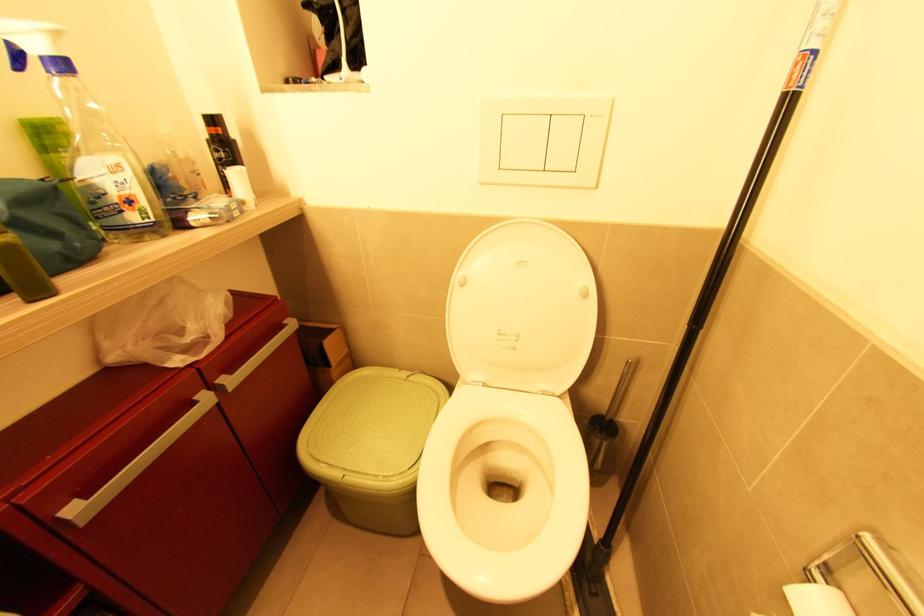
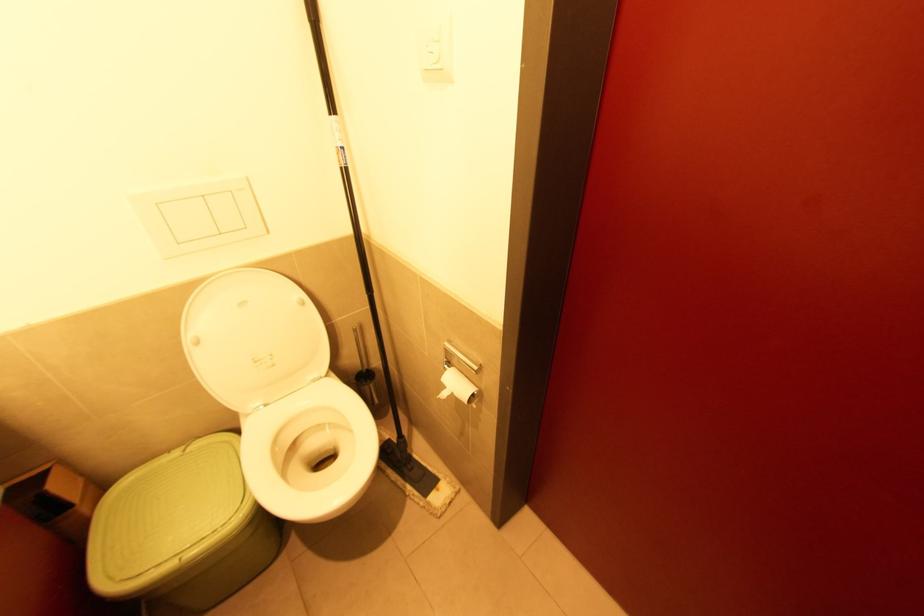
In the second image, find the point that corresponds to the point at 409,378 in the first image.

(187, 452)